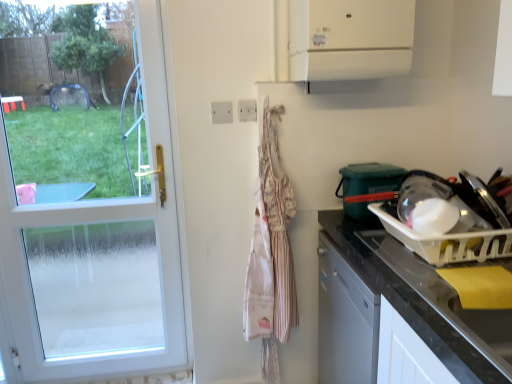
Question: From their relative heights in the image, would you say transparent plastic bowl at right, the first appliance positioned from the top, is taller or shorter than white plastic electric outlet at upper center, the first electric outlet viewed from the left?

Choices:
 (A) tall
 (B) short

Answer: (A)

Question: Considering the positions of point (345, 213) and point (221, 119), is point (345, 213) closer or farther from the camera than point (221, 119)?

Choices:
 (A) farther
 (B) closer

Answer: (A)

Question: Which of these objects is positioned closest to the white plastic electric outlet at upper center, the first electric outlet viewed from the left?

Choices:
 (A) transparent plastic bowl at right, the first appliance positioned from the top
 (B) white glass door at left
 (C) white plastic dish rack at right, the first appliance when ordered from bottom to top
 (D) white plastic electric outlet at upper center, marked as the second electric outlet in a left-to-right arrangement
 (E) black granite countertop at right

Answer: (D)

Question: Estimate the real-world distances between objects in this image. Which object is farther from the transparent plastic bowl at right, the first appliance positioned from the top?

Choices:
 (A) white plastic vent at upper center
 (B) white plastic electric outlet at upper center, the first electric outlet viewed from the left
 (C) white plastic electric outlet at upper center, marked as the second electric outlet in a left-to-right arrangement
 (D) striped fabric apron at center
 (E) white glass door at left

Answer: (E)